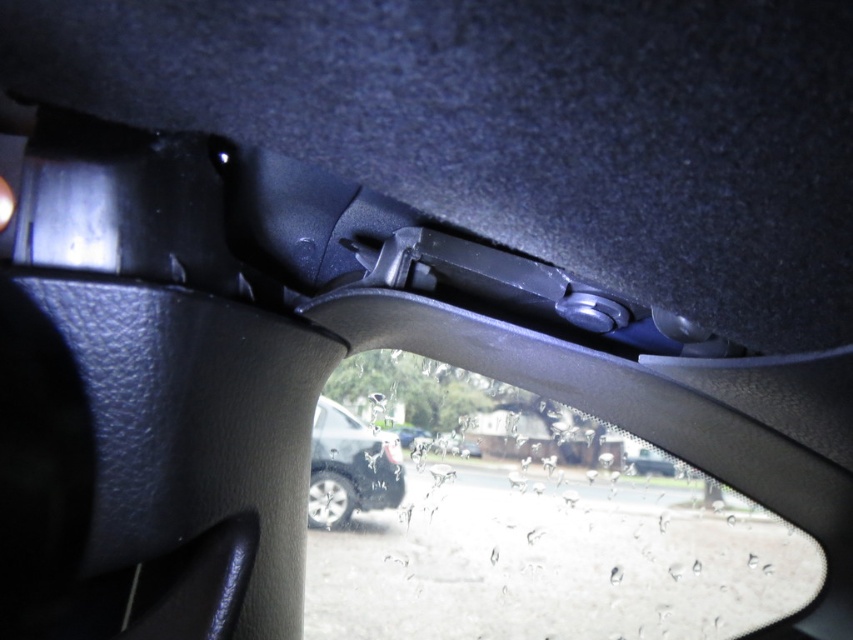
You are a delivery robot that is 7 inches wide. You need to pass through the space between the transparent plastic car window at center and the satin silver car at center. Can you fit through the space?

The distance between the transparent plastic car window at center and the satin silver car at center is 7.14 inches. Since the robot is 7 inches wide, it can fit through the space as the available space is slightly wider than the robot.

You are a mechanic inspecting the interior of a car. You notice the transparent plastic car window at center and the satin silver car at center. Which object is taller in this view?

The transparent plastic car window at center is much taller than the satin silver car at center in this view.

You are a delivery robot inside a car and need to pass through the space between the transparent plastic car window at center and the satin silver car at center. Your body is 0.5 meters wide. Can you fit through the space between them?

The transparent plastic car window at center might be wider than satin silver car at center, so there is a possibility that the space between them is at least 0.5 meters wide, allowing the robot to fit through. However, since the exact width isn not specified, the robot should proceed with caution.